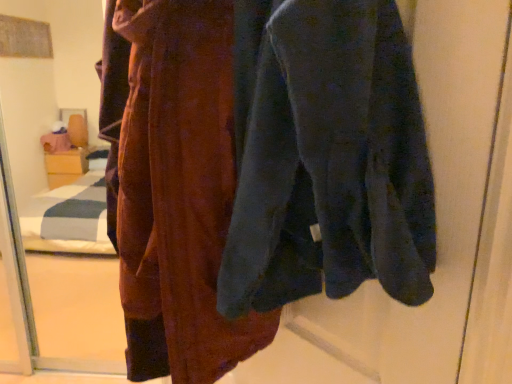
Question: Is point (318, 96) closer or farther from the camera than point (181, 190)?

Choices:
 (A) farther
 (B) closer

Answer: (B)

Question: Considering the relative positions of velvet dark blue sweatshirt at center and velvet maroon robe at center in the image provided, is velvet dark blue sweatshirt at center to the left or to the right of velvet maroon robe at center?

Choices:
 (A) right
 (B) left

Answer: (A)

Question: Is velvet dark blue sweatshirt at center bigger or smaller than velvet maroon robe at center?

Choices:
 (A) small
 (B) big

Answer: (A)

Question: From a real-world perspective, is velvet maroon robe at center positioned above or below velvet dark blue sweatshirt at center?

Choices:
 (A) below
 (B) above

Answer: (A)

Question: Is point (260, 322) closer or farther from the camera than point (284, 102)?

Choices:
 (A) closer
 (B) farther

Answer: (B)

Question: Considering their positions, is velvet maroon robe at center located in front of or behind velvet dark blue sweatshirt at center?

Choices:
 (A) front
 (B) behind

Answer: (B)

Question: From the image's perspective, relative to velvet dark blue sweatshirt at center, is velvet maroon robe at center above or below?

Choices:
 (A) below
 (B) above

Answer: (A)